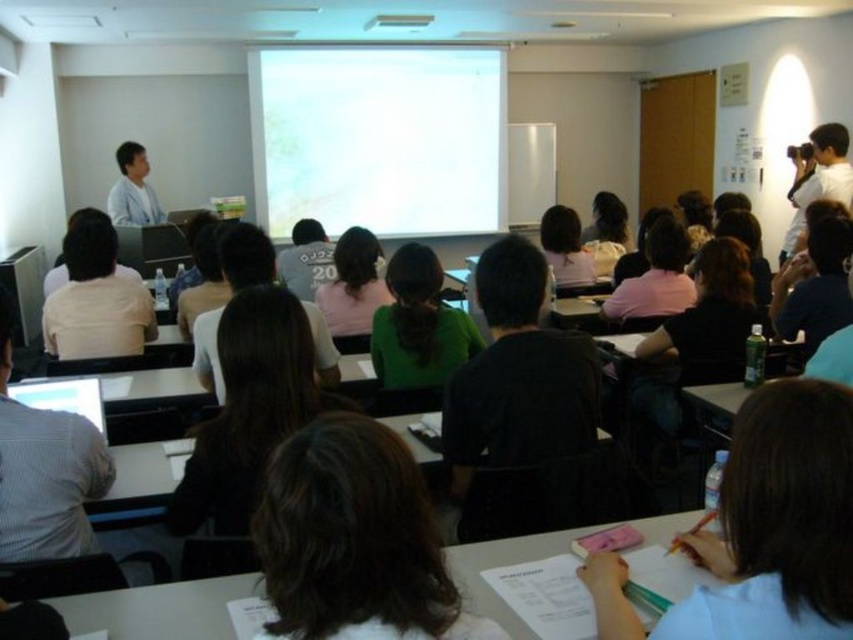
Which of these two, dark brown hair at center or green matte shirt at center, stands taller?

green matte shirt at center is taller.

Does dark brown hair at center have a larger size compared to green matte shirt at center?

No, dark brown hair at center is not bigger than green matte shirt at center.

Is point (292, 588) positioned in front of point (346, 280)?

Yes.

Image resolution: width=853 pixels, height=640 pixels. Identify the location of dark brown hair at center. (354, 540).

Is the position of dark brown hair at center more distant than that of light blue shirt at upper left?

No, dark brown hair at center is closer to the viewer.

Can you confirm if dark brown hair at center is wider than light blue shirt at upper left?

Incorrect, dark brown hair at center's width does not surpass light blue shirt at upper left's.

Find the location of a particular element. The width and height of the screenshot is (853, 640). dark brown hair at center is located at coordinates (354, 540).

Does point (724, 509) lie in front of point (154, 314)?

Yes, point (724, 509) is closer to viewer.

Between white paper at center and white shirt at left, which one appears on the left side from the viewer's perspective?

white shirt at left is more to the left.

Between point (775, 525) and point (41, 326), which one is positioned behind?

Point (41, 326)

Identify the location of white paper at center. This screenshot has width=853, height=640. (778, 522).